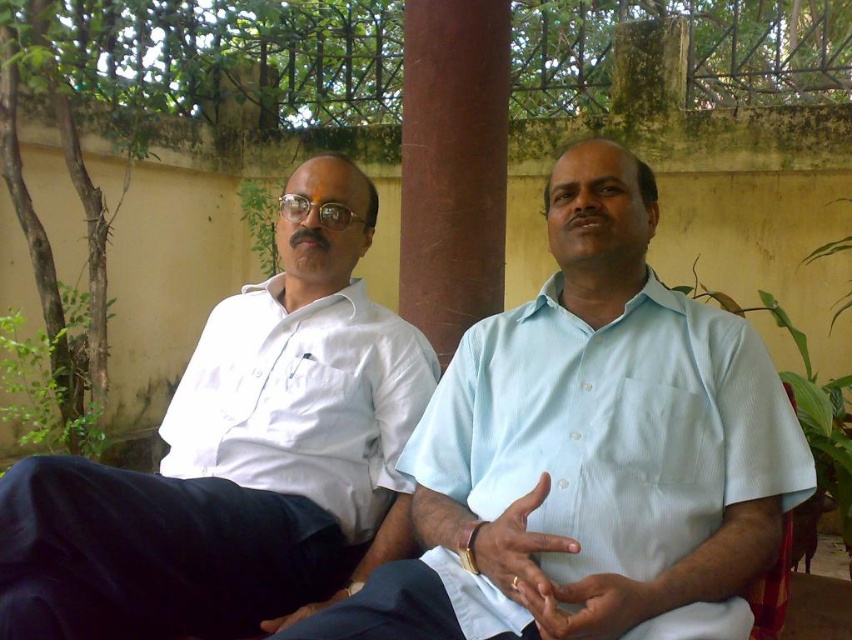
Question: Which point appears farthest from the camera in this image?

Choices:
 (A) (308, 310)
 (B) (330, 269)
 (C) (645, 548)

Answer: (A)

Question: Which point appears closest to the camera in this image?

Choices:
 (A) (291, 227)
 (B) (331, 416)
 (C) (418, 189)

Answer: (B)

Question: Is white cotton shirt at left to the right of brown polished wood at center from the viewer's perspective?

Choices:
 (A) yes
 (B) no

Answer: (B)

Question: Is white smooth shirt at left above brown polished wood at center?

Choices:
 (A) yes
 (B) no

Answer: (B)

Question: Which point is farther from the camera taking this photo?

Choices:
 (A) (260, 468)
 (B) (413, 147)
 (C) (409, 362)

Answer: (B)

Question: Can you confirm if white cotton shirt at left is thinner than brown polished wood at center?

Choices:
 (A) yes
 (B) no

Answer: (B)